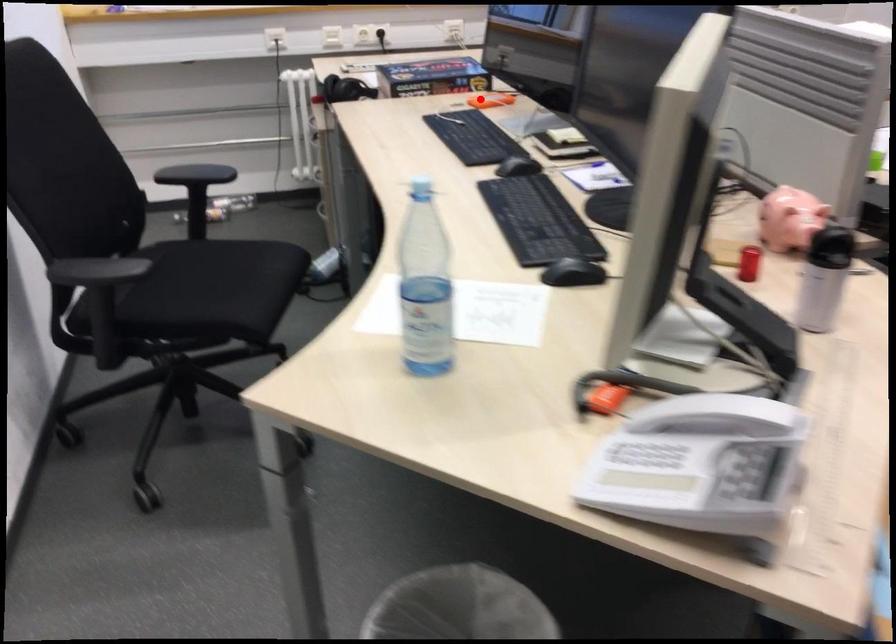
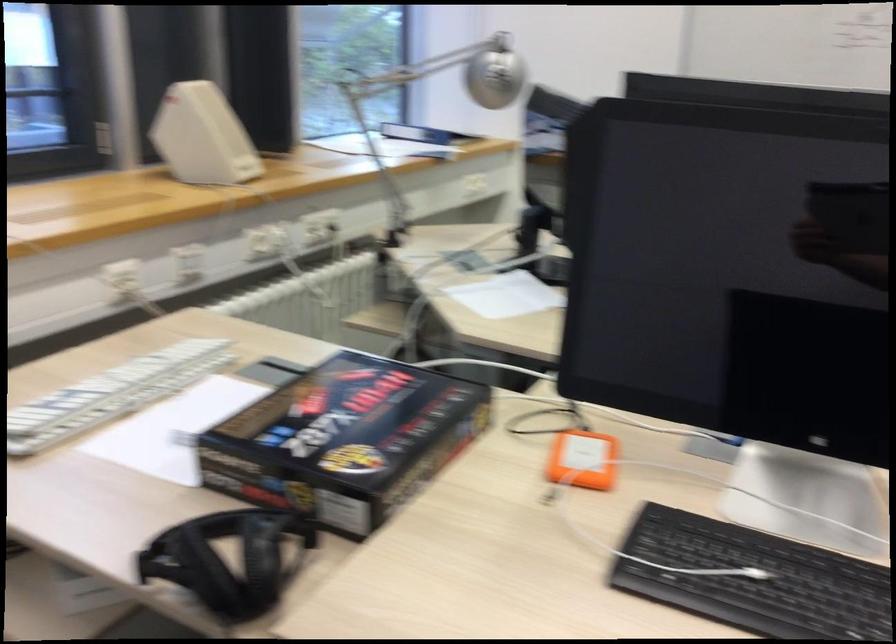
Question: I am providing you with two images of the same scene from different viewpoints. Given a red point in image1, look at the same physical point in image2. Is it:

Choices:
 (A) Closer to the viewpoint
 (B) Farther from the viewpoint

Answer: (A)